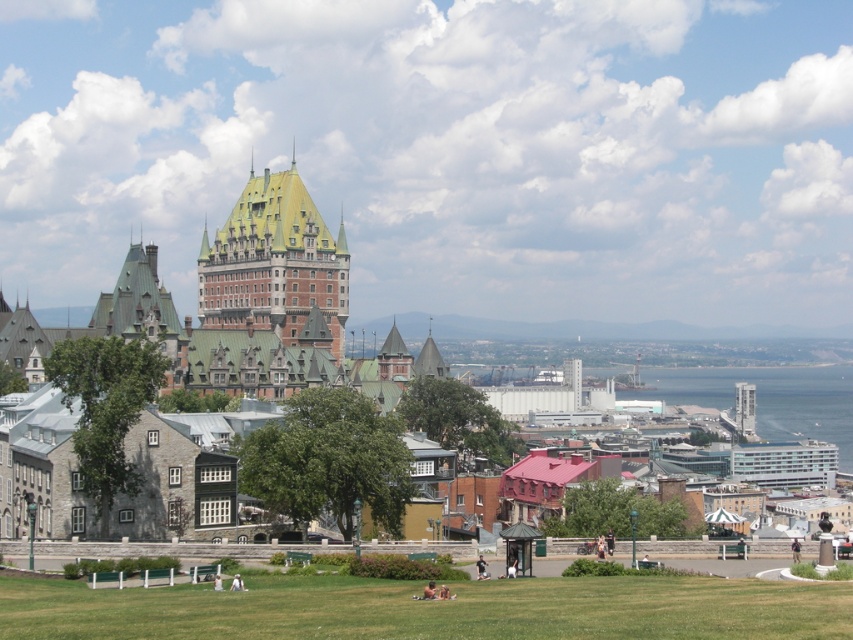
Question: Which point is closer to the camera?

Choices:
 (A) (289, 173)
 (B) (26, 317)

Answer: (B)

Question: Is green grassy field at lower center further to camera compared to gold shingles at center?

Choices:
 (A) no
 (B) yes

Answer: (A)

Question: Is gold shingles at center to the left of blue glass water at lower right from the viewer's perspective?

Choices:
 (A) no
 (B) yes

Answer: (B)

Question: Does green grassy field at lower center appear on the right side of stone building at center?

Choices:
 (A) no
 (B) yes

Answer: (B)

Question: Which object appears farthest from the camera in this image?

Choices:
 (A) gold shingles at center
 (B) blue glass water at lower right
 (C) green grassy field at lower center
 (D) stone building at center

Answer: (B)

Question: Which object appears farthest from the camera in this image?

Choices:
 (A) green grassy field at lower center
 (B) stone building at center
 (C) blue glass water at lower right

Answer: (C)